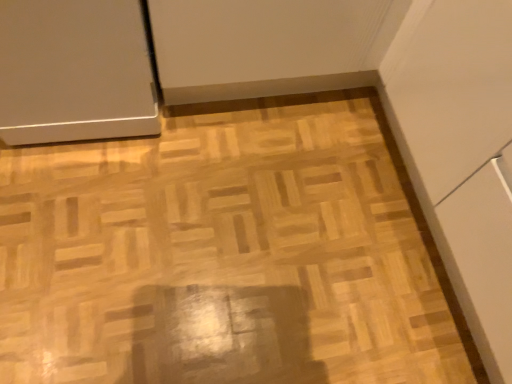
Question: Considering their positions, is natural wood parquet floor at center located in front of or behind satin white door at upper left?

Choices:
 (A) behind
 (B) front

Answer: (A)

Question: Considering the positions of natural wood parquet floor at center and satin white door at upper left in the image, is natural wood parquet floor at center bigger or smaller than satin white door at upper left?

Choices:
 (A) small
 (B) big

Answer: (A)

Question: From their relative heights in the image, would you say natural wood parquet floor at center is taller or shorter than satin white door at upper left?

Choices:
 (A) short
 (B) tall

Answer: (A)

Question: Is satin white door at upper left to the left or to the right of natural wood parquet floor at center in the image?

Choices:
 (A) right
 (B) left

Answer: (B)

Question: Looking at the image, does satin white door at upper left seem bigger or smaller compared to natural wood parquet floor at center?

Choices:
 (A) big
 (B) small

Answer: (A)

Question: Is satin white door at upper left taller or shorter than natural wood parquet floor at center?

Choices:
 (A) tall
 (B) short

Answer: (A)

Question: Does point (87, 71) appear closer or farther from the camera than point (225, 213)?

Choices:
 (A) closer
 (B) farther

Answer: (A)